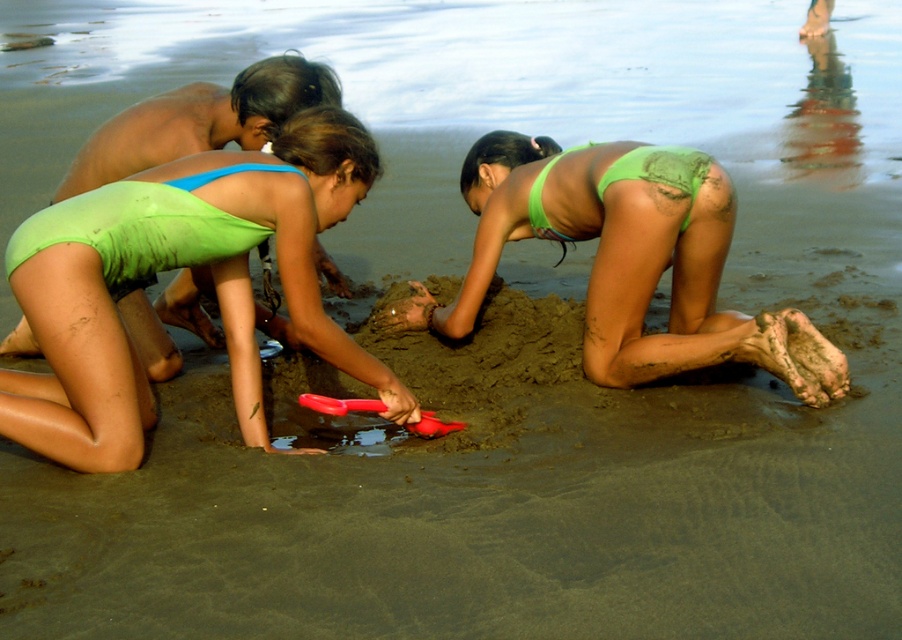
Question: Which point is closer to the camera?

Choices:
 (A) green matte swimsuit at center
 (B) rubber shovel at center

Answer: (A)

Question: Which point appears farthest from the camera in this image?

Choices:
 (A) (93, 198)
 (B) (369, 406)
 (C) (488, 230)

Answer: (C)

Question: Does green matte swimsuit at center come behind rubber shovel at center?

Choices:
 (A) yes
 (B) no

Answer: (B)

Question: Is green matte swimsuit at center to the right of rubber shovel at center from the viewer's perspective?

Choices:
 (A) yes
 (B) no

Answer: (B)

Question: From the image, what is the correct spatial relationship of green matte swimsuit at center in relation to rubber shovel at center?

Choices:
 (A) right
 (B) left

Answer: (B)

Question: Which object is the farthest from the green matte bikini bottom at center?

Choices:
 (A) green matte swimsuit at center
 (B) rubber shovel at center

Answer: (A)